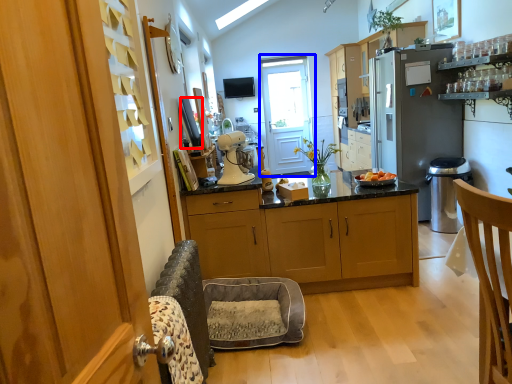
Question: Which of the following is the closest to the observer, oven (highlighted by a red box) or screen door (highlighted by a blue box)?

Choices:
 (A) oven
 (B) screen door

Answer: (A)